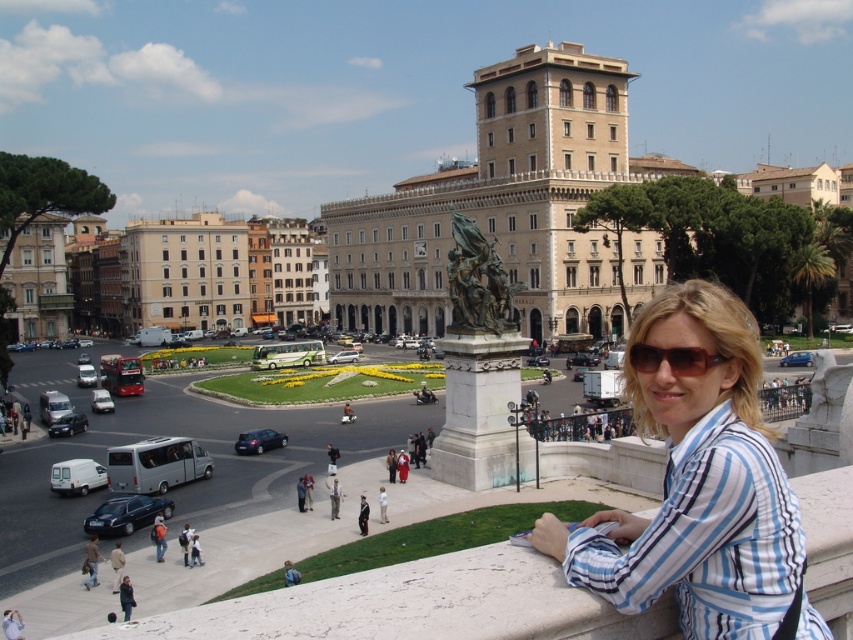
Is brown matte sunglasses at center smaller than orange backpack at lower left?

No.

Does brown matte sunglasses at center have a lesser height compared to orange backpack at lower left?

Yes.

Is point (677, 365) positioned after point (151, 536)?

That is False.

Find the location of a particular element. This screenshot has height=640, width=853. brown matte sunglasses at center is located at coordinates (672, 358).

Can you confirm if brown leather jacket at lower left is wider than blue denim jacket at lower left?

No.

What do you see at coordinates (91, 561) in the screenshot? The width and height of the screenshot is (853, 640). I see `brown leather jacket at lower left` at bounding box center [91, 561].

Which is in front, point (90, 564) or point (289, 568)?

Positioned in front is point (289, 568).

You are a GUI agent. You are given a task and a screenshot of the screen. Output one action in this format:
    pyautogui.click(x=<x>, y=<y>)
    Task: Click on the brown leather jacket at lower left
    
    Given the screenshot: What is the action you would take?
    pyautogui.click(x=91, y=561)

How much distance is there between light blue striped shirt at lower right and light beige pants at lower center?

They are 49.89 feet apart.

Which is more to the right, light blue striped shirt at lower right or light beige pants at lower center?

light beige pants at lower center is more to the right.

Where is `light blue striped shirt at lower right`? The height and width of the screenshot is (640, 853). light blue striped shirt at lower right is located at coordinates click(117, 564).